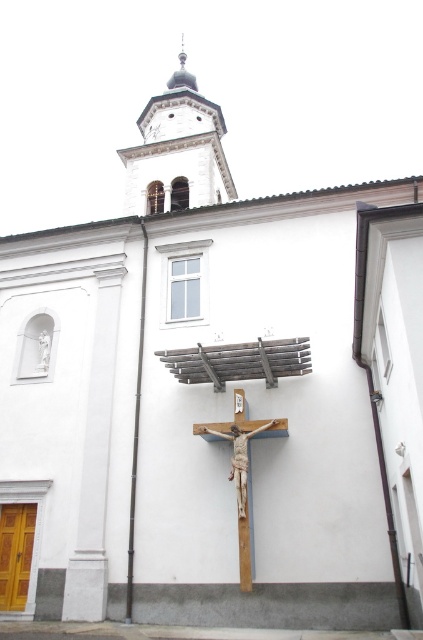
You are standing in front of the church and want to take a photo of the wooden cross at center without the smooth white stone spire at upper center blocking it. How should you adjust your position?

Move to the side so that the wooden cross at center is no longer aligned with the smooth white stone spire at upper center. Since the wooden cross at center is behind the spire, shifting your position sideways will allow you to see the cross without the spire blocking it.

You are standing at the entrance of the white church and notice two points marked on the building. The first point is at coordinates point (139,200), and the second is at point (211,428). Which point is closer to you?

Point (211,428) is closer to you because it is in front of point (139,200).